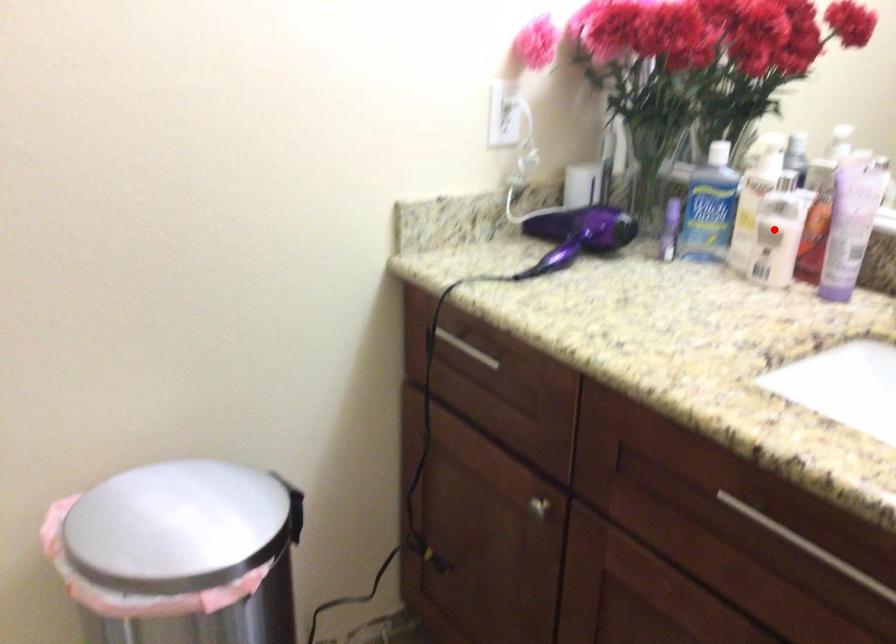
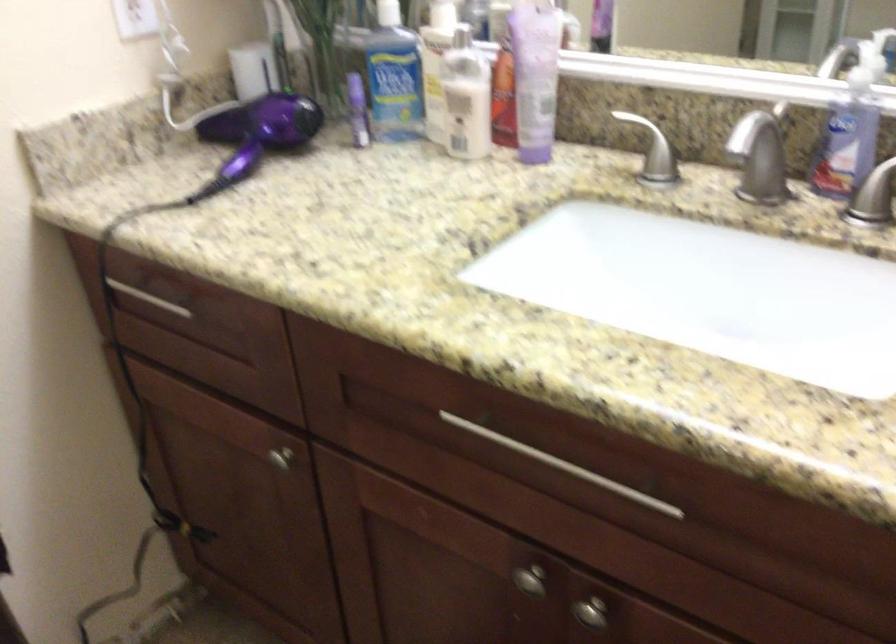
In the second image, find the point that corresponds to the highlighted location in the first image.

(466, 98)